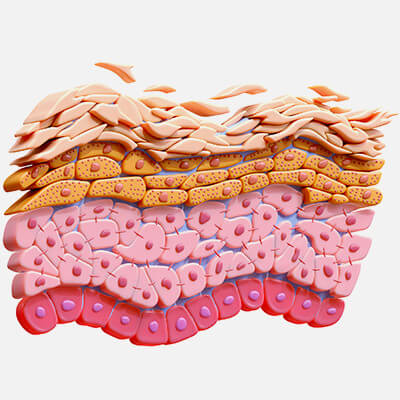
Locate an element on the screen. This screenshot has width=400, height=400. tissue is located at coordinates (320, 231).